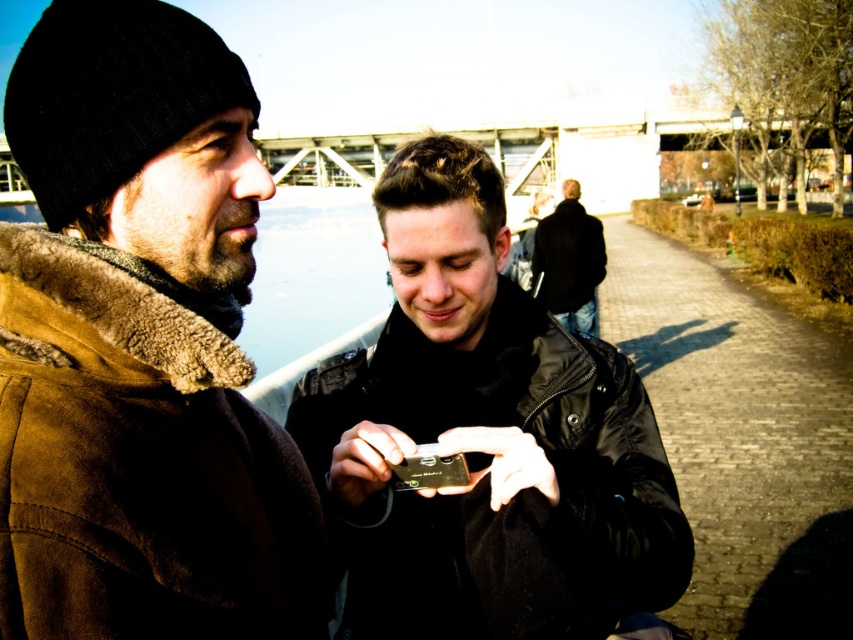
You are a photographer trying to capture a candid shot of two people. You notice a black matte phone at center and a black leather jacket at center in the scene. Which object is located to the left of the other?

The black matte phone at center is positioned on the left side of black leather jacket at center.

You are a photographer trying to capture a candid shot of two people. You notice the black matte phone at center and the black leather jacket at center in your frame. Which object should you zoom in on to ensure both fit in the photo without cropping?

The black leather jacket at center is narrower than the black matte phone at center, so zooming in on the black leather jacket at center would allow both objects to fit without cropping.

Consider the image. You are standing at the origin point of the coordinate system. There is a suede jacket at left located at point (138, 353). If you want to walk towards the suede jacket at left, which direction should you move?

The suede jacket at left is located at point (138, 353). Since the coordinate system typically has 0,0 at the bottom left corner, moving towards the suede jacket would require moving to the right and slightly upwards.